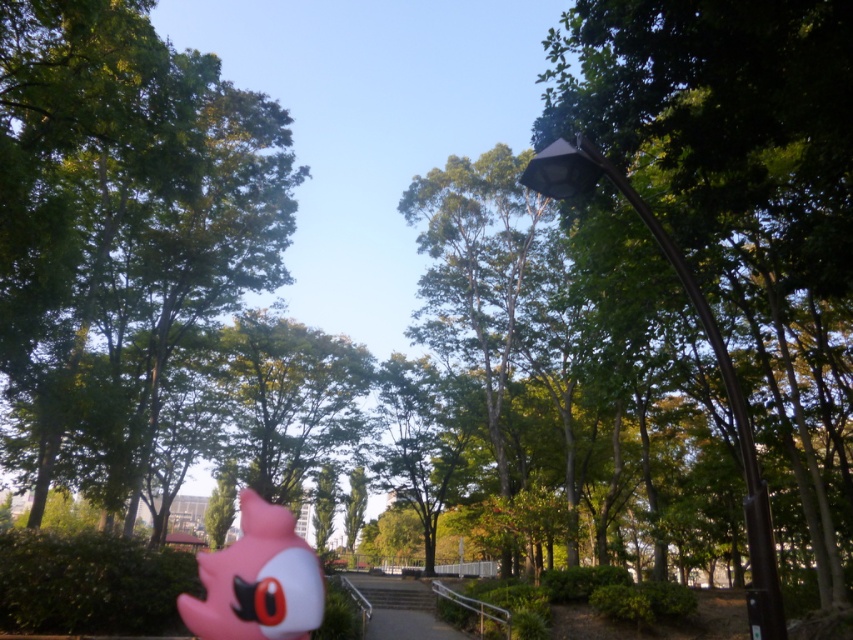
Does pink matte plush toy at lower left appear on the left side of white concrete stairs at center?

Yes, pink matte plush toy at lower left is to the left of white concrete stairs at center.

Who is more forward, (x=270, y=504) or (x=361, y=579)?

Point (x=270, y=504) is more forward.

Where is `pink matte plush toy at lower left`? This screenshot has height=640, width=853. pink matte plush toy at lower left is located at coordinates (257, 580).

What do you see at coordinates (712, 353) in the screenshot?
I see `metallic gray streetlight at right` at bounding box center [712, 353].

Between metallic gray streetlight at right and white concrete stairs at center, which one has more height?

white concrete stairs at center is taller.

Which is behind, point (596, 156) or point (431, 621)?

Point (431, 621)

This screenshot has height=640, width=853. I want to click on metallic gray streetlight at right, so click(712, 353).

Is green leafy tree at center smaller than pink matte plush toy at lower left?

No, green leafy tree at center is not smaller than pink matte plush toy at lower left.

Which is behind, point (137, 188) or point (305, 550)?

The point (137, 188) is more distant.

Where is `green leafy tree at center`? Image resolution: width=853 pixels, height=640 pixels. green leafy tree at center is located at coordinates (120, 221).